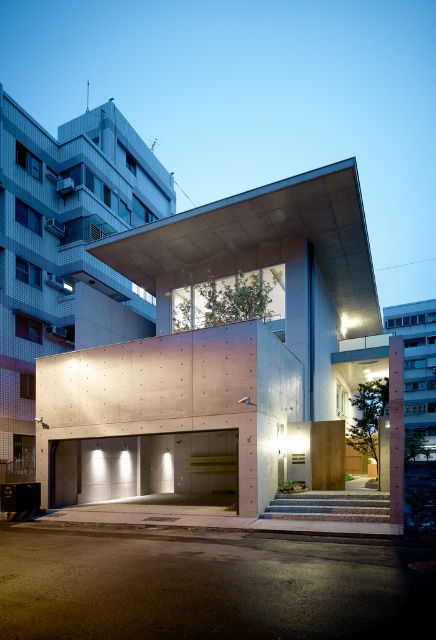
You are a delivery driver arriving at this modern building. You need to park your truck in the parking area. Based on the scene, which object should you head towards, the concrete parking garage at center or the smooth concrete at lower center?

The concrete parking garage at center is bigger than the smooth concrete at lower center, so you should head towards the concrete parking garage at center for parking.

You are a delivery driver trying to park your truck in the parking area. The truck requires a space that is wider than the smooth concrete at lower center. Can you park your truck in the concrete parking garage at center?

The concrete parking garage at center might be wider than smooth concrete at lower center, so it is possible that the truck can park there.

You are standing in front of the modern architectural structure and want to park your car. The entrance to the parking area is located at the smooth concrete at lower center. Which direction should you turn to reach the concrete parking garage at center from the entrance?

You should turn to your right because the concrete parking garage at center is located to the right of the smooth concrete at lower center, which is where the entrance is.